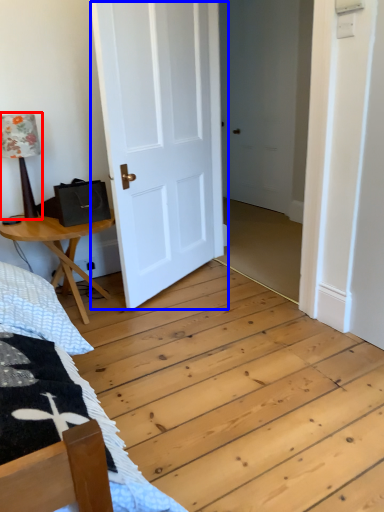
Question: Which object appears closest to the camera in this image, table lamp (highlighted by a red box) or door (highlighted by a blue box)?

Choices:
 (A) table lamp
 (B) door

Answer: (B)